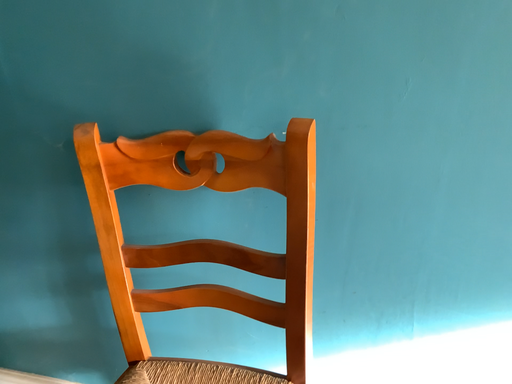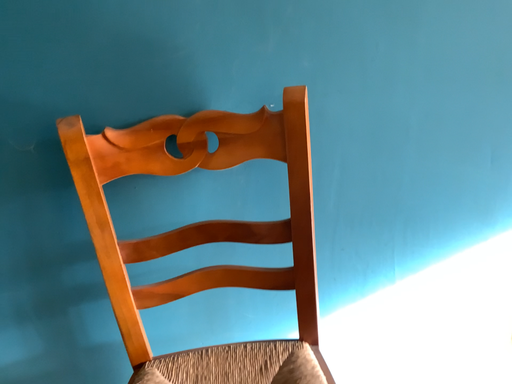
Question: How did the camera likely rotate when shooting the video?

Choices:
 (A) rotated right
 (B) rotated left

Answer: (A)